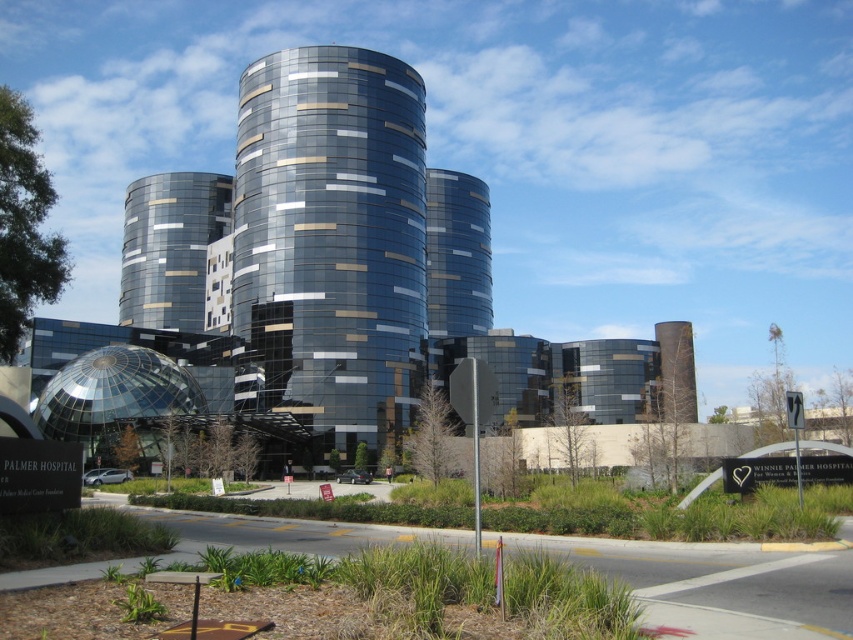
Question: Among these objects, which one is farthest from the camera?

Choices:
 (A) glossy glass tower at center
 (B) metallic glass building at center

Answer: (B)

Question: Can you confirm if glossy glass tower at center is bigger than metallic glass building at center?

Choices:
 (A) yes
 (B) no

Answer: (A)

Question: Among these points, which one is farthest from the camera?

Choices:
 (A) (279, 186)
 (B) (132, 209)

Answer: (B)

Question: Does glossy glass tower at center appear on the right side of metallic glass building at center?

Choices:
 (A) yes
 (B) no

Answer: (A)

Question: Is glossy glass tower at center below metallic glass building at center?

Choices:
 (A) yes
 (B) no

Answer: (A)